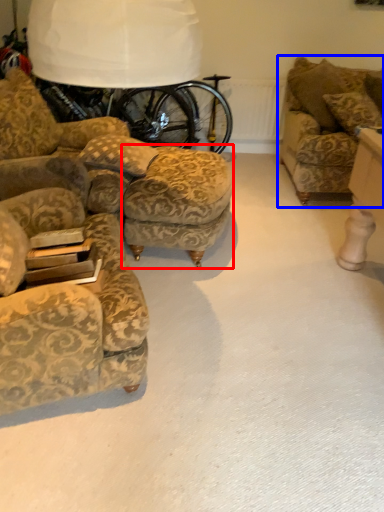
Question: Among these objects, which one is farthest to the camera, stool (highlighted by a red box) or studio couch (highlighted by a blue box)?

Choices:
 (A) stool
 (B) studio couch

Answer: (B)